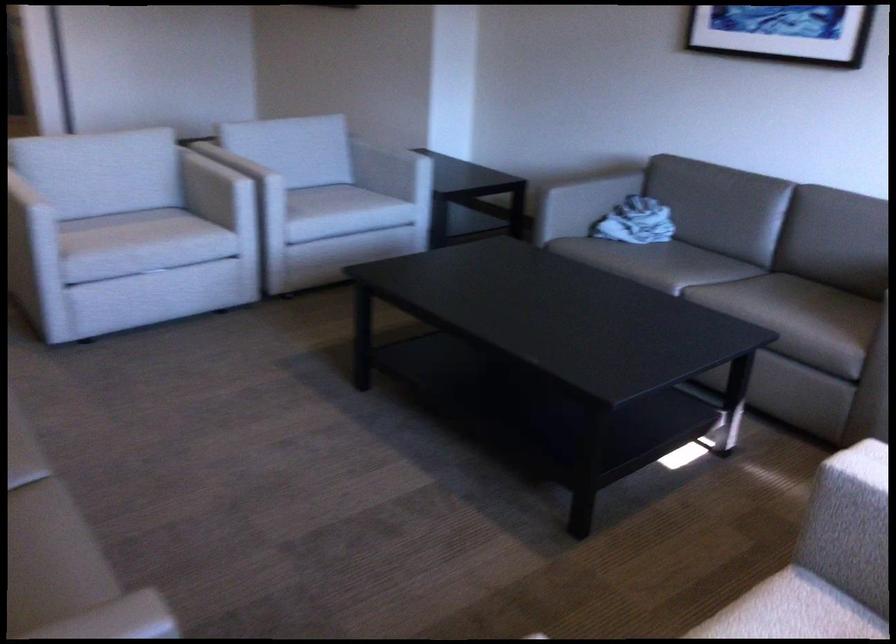
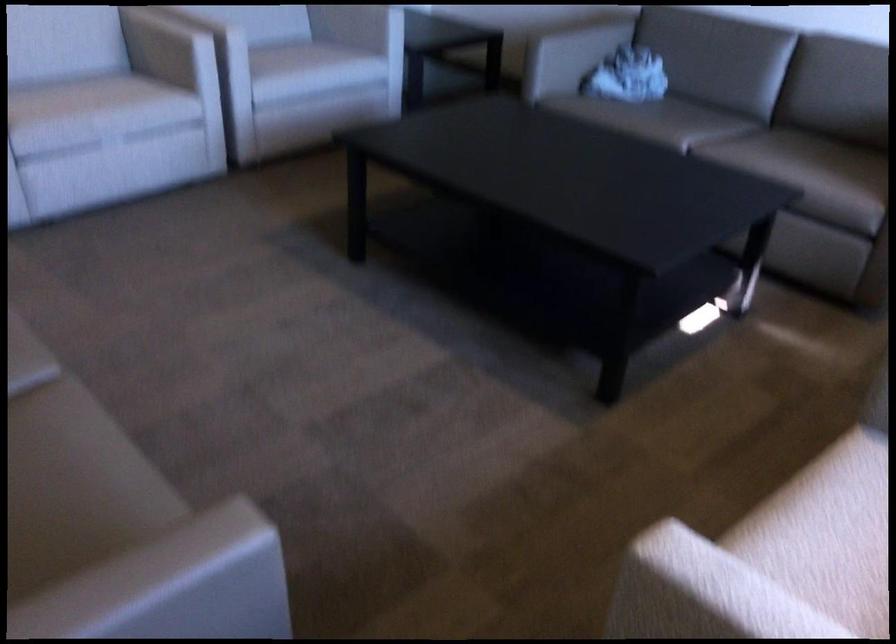
Where in the second image is the point corresponding to [261,222] from the first image?

(227, 80)